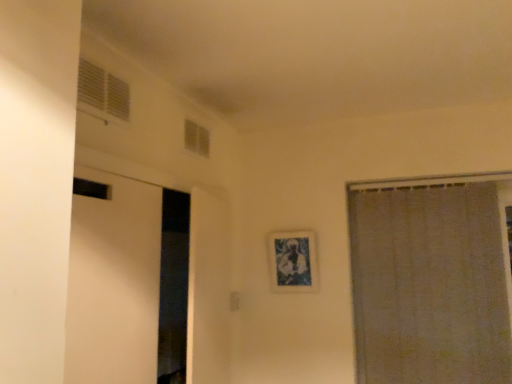
Describe the element at coordinates (429, 280) in the screenshot. I see `white sheer curtain at right` at that location.

You are a GUI agent. You are given a task and a screenshot of the screen. Output one action in this format:
    pyautogui.click(x=<x>, y=<y>)
    Task: Click on the white plastic vent at upper left, the second window in the back-to-front sequence
    The width and height of the screenshot is (512, 384).
    Given the screenshot: What is the action you would take?
    pyautogui.click(x=103, y=92)

Locate an element on the screen. This screenshot has width=512, height=384. white sheer curtain at right is located at coordinates pos(429,280).

Could you tell me if white plastic vent at upper left, the second window in the back-to-front sequence, is turned towards blue textured fabric picture frame at center?

No, white plastic vent at upper left, the second window in the back-to-front sequence, is not aimed at blue textured fabric picture frame at center.

Can you confirm if white plastic vent at upper left, which appears as the first window when viewed from the front, is bigger than blue textured fabric picture frame at center?

No, white plastic vent at upper left, which appears as the first window when viewed from the front, is not bigger than blue textured fabric picture frame at center.

Is white plastic vent at upper left, the second window in the back-to-front sequence, inside or outside of blue textured fabric picture frame at center?

white plastic vent at upper left, the second window in the back-to-front sequence, is outside blue textured fabric picture frame at center.

Is white plastic vent at upper left, which ranks as the second window in right-to-left order, with blue textured fabric picture frame at center?

They are not placed beside each other.

Is white sheer curtain at right thinner than transparent glass window at upper center, positioned as the first window in back-to-front order?

Incorrect, the width of white sheer curtain at right is not less than that of transparent glass window at upper center, positioned as the first window in back-to-front order.

Considering the positions of objects white sheer curtain at right and transparent glass window at upper center, acting as the 2th window starting from the front, in the image provided, who is in front, white sheer curtain at right or transparent glass window at upper center, acting as the 2th window starting from the front,?

transparent glass window at upper center, acting as the 2th window starting from the front, is in front.

Which object is positioned more to the left, white sheer curtain at right or transparent glass window at upper center, acting as the 2th window starting from the front?

From the viewer's perspective, transparent glass window at upper center, acting as the 2th window starting from the front, appears more on the left side.

Is point (511, 172) more distant than point (198, 150)?

No, (511, 172) is in front of (198, 150).

Relative to white plastic vent at upper left, which appears as the first window when viewed from the front, is transparent glass window at upper center, acting as the 2th window starting from the front, in front or behind?

transparent glass window at upper center, acting as the 2th window starting from the front, is behind white plastic vent at upper left, which appears as the first window when viewed from the front.

Between transparent glass window at upper center, acting as the 2th window starting from the front, and white plastic vent at upper left, the second window in the back-to-front sequence, which one has more height?

Standing taller between the two is white plastic vent at upper left, the second window in the back-to-front sequence.

Do you think transparent glass window at upper center, acting as the 2th window starting from the front, is within white plastic vent at upper left, which ranks as the first window in left-to-right order, or outside of it?

transparent glass window at upper center, acting as the 2th window starting from the front, is not inside white plastic vent at upper left, which ranks as the first window in left-to-right order, it's outside.

Relative to blue textured fabric picture frame at center, is transparent glass window at upper center, positioned as the first window in back-to-front order, in front or behind?

Clearly, transparent glass window at upper center, positioned as the first window in back-to-front order, is in front of blue textured fabric picture frame at center.

Find the location of a particular element. This screenshot has width=512, height=384. picture frame located underneath the transparent glass window at upper center, positioned as the first window in back-to-front order (from a real-world perspective) is located at coordinates (293, 262).

In the scene shown: From the image's perspective, which is above, transparent glass window at upper center, positioned as the first window in back-to-front order, or white sheer curtain at right?

transparent glass window at upper center, positioned as the first window in back-to-front order, from the image's perspective.

Is transparent glass window at upper center, acting as the 2th window starting from the front, oriented away from white sheer curtain at right?

No, transparent glass window at upper center, acting as the 2th window starting from the front, is not facing away from white sheer curtain at right.

Based on the photo, considering the relative positions of transparent glass window at upper center, which appears as the 2th window when viewed from the left, and white sheer curtain at right in the image provided, is transparent glass window at upper center, which appears as the 2th window when viewed from the left, to the left or to the right of white sheer curtain at right?

From the image, it's evident that transparent glass window at upper center, which appears as the 2th window when viewed from the left, is to the left of white sheer curtain at right.

Is transparent glass window at upper center, positioned as the first window in back-to-front order, in front of or behind white sheer curtain at right in the image?

transparent glass window at upper center, positioned as the first window in back-to-front order, is positioned closer to the viewer than white sheer curtain at right.

How many degrees apart are the facing directions of blue textured fabric picture frame at center and white sheer curtain at right?

The facing directions of blue textured fabric picture frame at center and white sheer curtain at right are 0.0393 degrees apart.

Considering the relative positions of blue textured fabric picture frame at center and white sheer curtain at right in the image provided, is blue textured fabric picture frame at center to the right of white sheer curtain at right from the viewer's perspective?

In fact, blue textured fabric picture frame at center is to the left of white sheer curtain at right.

Who is bigger, blue textured fabric picture frame at center or white sheer curtain at right?

Bigger between the two is white sheer curtain at right.

From their relative heights in the image, would you say blue textured fabric picture frame at center is taller or shorter than white sheer curtain at right?

Considering their sizes, blue textured fabric picture frame at center has less height than white sheer curtain at right.

Does white plastic vent at upper left, the second window in the back-to-front sequence, have a greater height compared to white sheer curtain at right?

No, white plastic vent at upper left, the second window in the back-to-front sequence, is not taller than white sheer curtain at right.

Could you tell me if white plastic vent at upper left, which ranks as the second window in right-to-left order, is turned towards white sheer curtain at right?

No, white plastic vent at upper left, which ranks as the second window in right-to-left order, is not aimed at white sheer curtain at right.

Is white plastic vent at upper left, which ranks as the second window in right-to-left order, located outside white sheer curtain at right?

Yes, white plastic vent at upper left, which ranks as the second window in right-to-left order, is outside of white sheer curtain at right.

Is point (120, 112) positioned after point (458, 365)?

No, (120, 112) is in front of (458, 365).

This screenshot has width=512, height=384. What are the coordinates of `picture frame below the white plastic vent at upper left, which ranks as the second window in right-to-left order (from a real-world perspective)` in the screenshot? It's located at (293, 262).

In the image, there is a transparent glass window at upper center, which appears as the first window when viewed from the right. Where is `curtain below it (from the image's perspective)`? The width and height of the screenshot is (512, 384). curtain below it (from the image's perspective) is located at coordinates (429, 280).

Looking at the image, which one is located further to transparent glass window at upper center, which appears as the first window when viewed from the right, white sheer curtain at right or blue textured fabric picture frame at center?

white sheer curtain at right is positioned further to the anchor transparent glass window at upper center, which appears as the first window when viewed from the right.

Considering their positions, is white plastic vent at upper left, which ranks as the first window in left-to-right order, positioned further to blue textured fabric picture frame at center than white sheer curtain at right?

Based on the image, white plastic vent at upper left, which ranks as the first window in left-to-right order, appears to be further to blue textured fabric picture frame at center.

Which object lies further to the anchor point white sheer curtain at right, white plastic vent at upper left, which appears as the first window when viewed from the front, or blue textured fabric picture frame at center?

white plastic vent at upper left, which appears as the first window when viewed from the front, is further to white sheer curtain at right.

From the image, which object appears to be nearer to blue textured fabric picture frame at center, white sheer curtain at right or white plastic vent at upper left, which ranks as the first window in left-to-right order?

Based on the image, white sheer curtain at right appears to be nearer to blue textured fabric picture frame at center.

Looking at the image, which one is located further to white plastic vent at upper left, which ranks as the second window in right-to-left order, blue textured fabric picture frame at center or transparent glass window at upper center, which appears as the 2th window when viewed from the left?

Among the two, blue textured fabric picture frame at center is located further to white plastic vent at upper left, which ranks as the second window in right-to-left order.

When comparing their distances from white plastic vent at upper left, which appears as the first window when viewed from the front, does white sheer curtain at right or transparent glass window at upper center, which appears as the first window when viewed from the right, seem closer?

transparent glass window at upper center, which appears as the first window when viewed from the right, lies closer to white plastic vent at upper left, which appears as the first window when viewed from the front, than the other object.

Estimate the real-world distances between objects in this image. Which object is closer to white plastic vent at upper left, which appears as the first window when viewed from the front, white sheer curtain at right or blue textured fabric picture frame at center?

blue textured fabric picture frame at center lies closer to white plastic vent at upper left, which appears as the first window when viewed from the front, than the other object.

When comparing their distances from white sheer curtain at right, does blue textured fabric picture frame at center or white plastic vent at upper left, which ranks as the first window in left-to-right order, seem further?

white plastic vent at upper left, which ranks as the first window in left-to-right order, is positioned further to the anchor white sheer curtain at right.

The height and width of the screenshot is (384, 512). In order to click on picture frame situated between white plastic vent at upper left, which ranks as the second window in right-to-left order, and white sheer curtain at right from left to right in this screenshot , I will do `click(293, 262)`.

Where is `picture frame between transparent glass window at upper center, which appears as the first window when viewed from the right, and white sheer curtain at right`? picture frame between transparent glass window at upper center, which appears as the first window when viewed from the right, and white sheer curtain at right is located at coordinates (293, 262).

The height and width of the screenshot is (384, 512). I want to click on window between white plastic vent at upper left, which ranks as the second window in right-to-left order, and white sheer curtain at right from left to right, so click(x=197, y=138).

The image size is (512, 384). I want to click on window positioned between white plastic vent at upper left, which appears as the first window when viewed from the front, and blue textured fabric picture frame at center from near to far, so click(x=197, y=138).